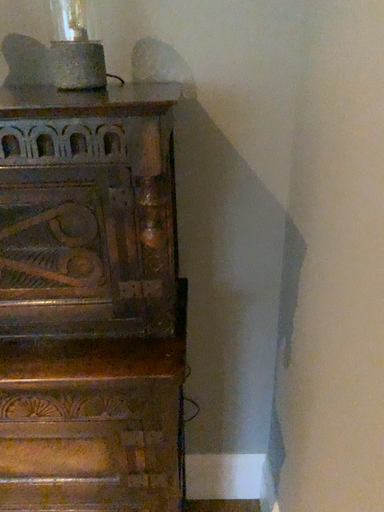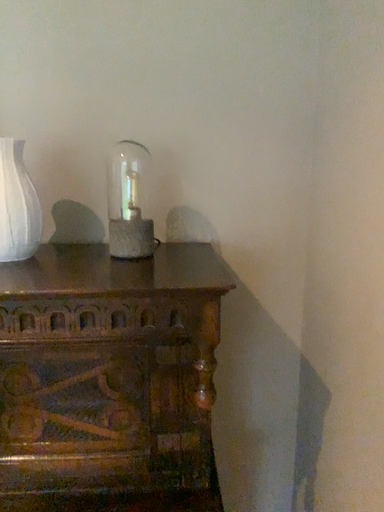
Question: How did the camera likely rotate when shooting the video?

Choices:
 (A) rotated downward
 (B) rotated upward

Answer: (B)